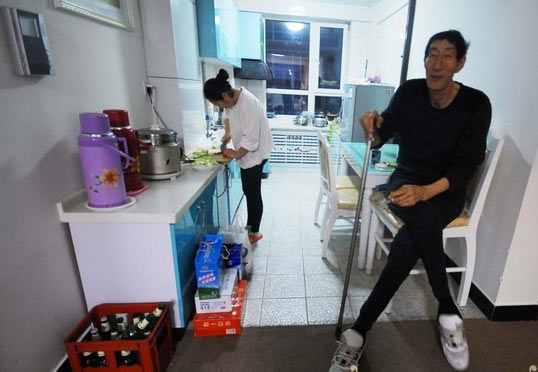
In order to click on bottles in this screenshot , I will do `click(134, 330)`.